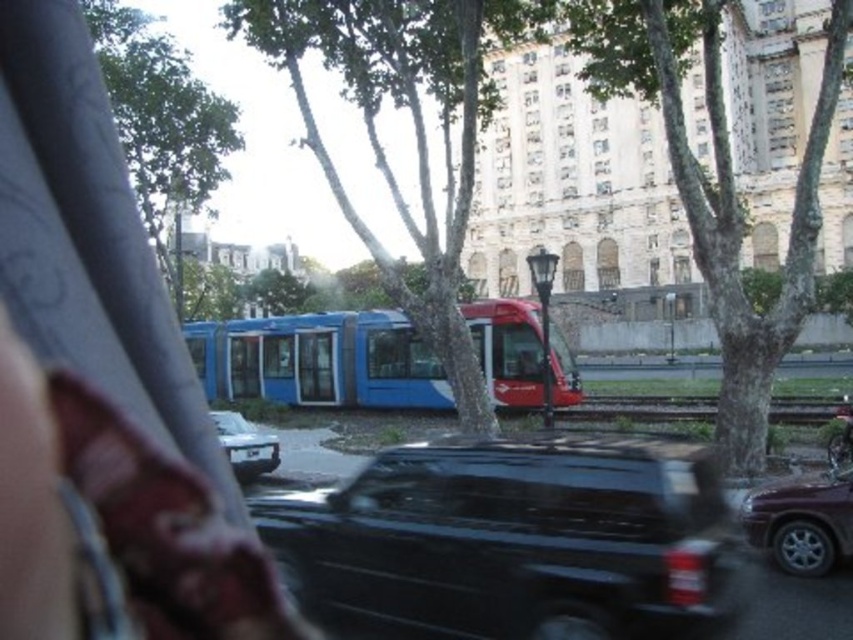
Question: Does blue matte bus at center have a lesser width compared to white glossy car at center?

Choices:
 (A) yes
 (B) no

Answer: (B)

Question: Which of the following is the farthest from the observer?

Choices:
 (A) shiny maroon suv at lower right
 (B) blue matte bus at center
 (C) shiny black suv at center
 (D) smooth bark tree at center

Answer: (B)

Question: Can you confirm if smooth bark tree at center is positioned below blue matte bus at center?

Choices:
 (A) yes
 (B) no

Answer: (B)

Question: Which point is farther to the camera?

Choices:
 (A) shiny maroon suv at lower right
 (B) blue matte bus at center

Answer: (B)

Question: Which is nearer to the blue matte bus at center?

Choices:
 (A) white glossy car at center
 (B) smooth bark tree at center
 (C) shiny black suv at center

Answer: (A)

Question: Can you confirm if shiny maroon suv at lower right is positioned to the left of white glossy car at center?

Choices:
 (A) no
 (B) yes

Answer: (A)